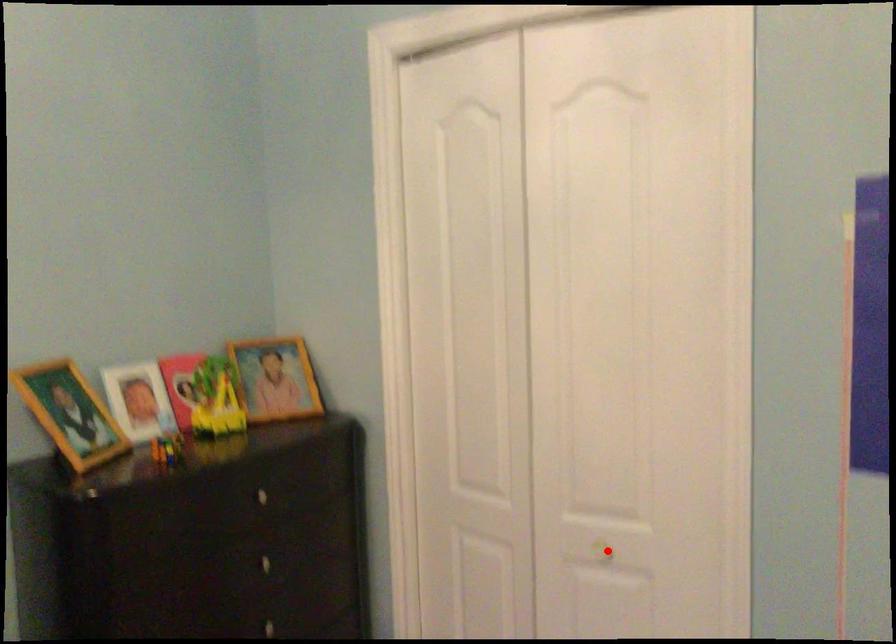
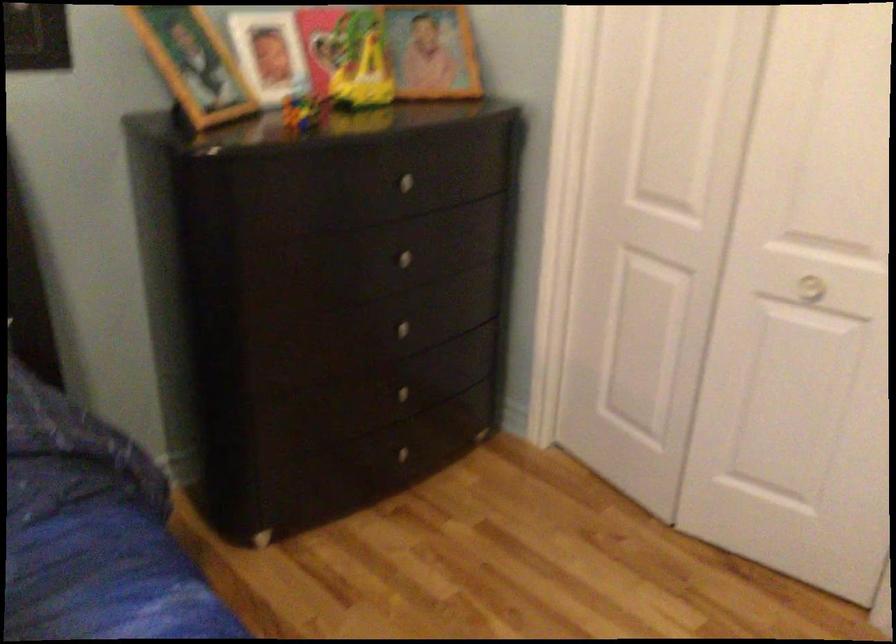
Question: I am providing you with two images of the same scene from different viewpoints. In image1, a red point is highlighted. Considering the same 3D point in image2, which of the following is correct?

Choices:
 (A) It is closer
 (B) It is farther

Answer: (A)